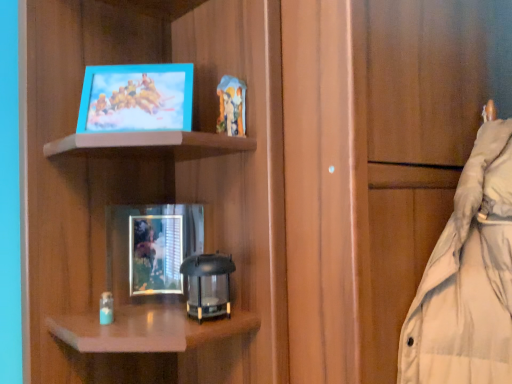
Question: From the image's perspective, is matte blue picture frame at upper left, which is counted as the 1th picture frame, starting from the top, below matte wood cabinet at center?

Choices:
 (A) yes
 (B) no

Answer: (B)

Question: Is matte blue picture frame at upper left, which is counted as the 1th picture frame, starting from the top, far from matte wood cabinet at center?

Choices:
 (A) no
 (B) yes

Answer: (A)

Question: Is matte blue picture frame at upper left, the second picture frame positioned from the back, thinner than matte wood cabinet at center?

Choices:
 (A) no
 (B) yes

Answer: (B)

Question: From the image's perspective, is matte blue picture frame at upper left, which is counted as the 1th picture frame, starting from the top, on matte wood cabinet at center?

Choices:
 (A) no
 (B) yes

Answer: (B)

Question: Considering the relative sizes of matte blue picture frame at upper left, the second picture frame positioned from the back, and matte wood cabinet at center in the image provided, is matte blue picture frame at upper left, the second picture frame positioned from the back, smaller than matte wood cabinet at center?

Choices:
 (A) no
 (B) yes

Answer: (B)

Question: Is point (419, 122) positioned closer to the camera than point (186, 115)?

Choices:
 (A) farther
 (B) closer

Answer: (A)

Question: Considering the relative positions of matte wood cabinet at center and matte blue picture frame at upper left, marked as the 1th picture frame in a front-to-back arrangement, in the image provided, is matte wood cabinet at center to the left or to the right of matte blue picture frame at upper left, marked as the 1th picture frame in a front-to-back arrangement,?

Choices:
 (A) left
 (B) right

Answer: (B)

Question: From the image's perspective, is matte wood cabinet at center located above or below matte blue picture frame at upper left, which is counted as the 1th picture frame, starting from the top?

Choices:
 (A) below
 (B) above

Answer: (A)

Question: In terms of size, does matte wood cabinet at center appear bigger or smaller than matte blue picture frame at upper left, which is counted as the 1th picture frame, starting from the top?

Choices:
 (A) big
 (B) small

Answer: (A)

Question: Relative to matte blue picture frame at upper left, positioned as the 2th picture frame in bottom-to-top order, is metallic silver picture frame at center, which is the second picture frame in top-to-bottom order, in front or behind?

Choices:
 (A) behind
 (B) front

Answer: (A)

Question: Is metallic silver picture frame at center, which is the 2th picture frame from front to back, wider or thinner than matte blue picture frame at upper left, the second picture frame positioned from the back?

Choices:
 (A) wide
 (B) thin

Answer: (B)

Question: Considering the positions of point (166, 236) and point (119, 130), is point (166, 236) closer or farther from the camera than point (119, 130)?

Choices:
 (A) closer
 (B) farther

Answer: (B)

Question: From their relative heights in the image, would you say metallic silver picture frame at center, which is the second picture frame in top-to-bottom order, is taller or shorter than matte blue picture frame at upper left, positioned as the 2th picture frame in bottom-to-top order?

Choices:
 (A) tall
 (B) short

Answer: (A)

Question: Looking at their shapes, would you say matte wood cabinet at center is wider or thinner than metallic silver picture frame at center, which is the second picture frame in top-to-bottom order?

Choices:
 (A) wide
 (B) thin

Answer: (A)

Question: Based on their sizes in the image, would you say matte wood cabinet at center is bigger or smaller than metallic silver picture frame at center, which is the 1th picture frame in bottom-to-top order?

Choices:
 (A) small
 (B) big

Answer: (B)